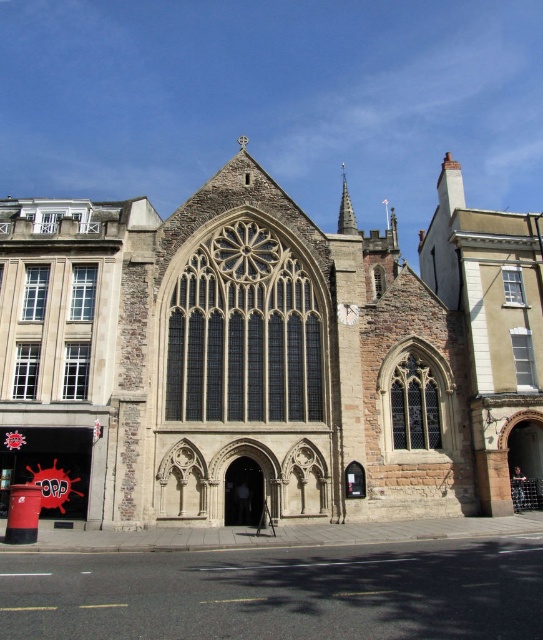
Consider the image. Can you confirm if smooth stone spire at upper center is thinner than white stone clock at center?

In fact, smooth stone spire at upper center might be wider than white stone clock at center.

Is smooth stone spire at upper center to the left of white stone clock at center from the viewer's perspective?

Incorrect, smooth stone spire at upper center is not on the left side of white stone clock at center.

Does point (343, 173) come behind point (345, 317)?

Yes, it is behind point (345, 317).

Identify the location of smooth stone spire at upper center. (345, 209).

Does beige stone church at center appear on the right side of smooth stone spire at upper center?

No, beige stone church at center is not to the right of smooth stone spire at upper center.

Does beige stone church at center lie in front of smooth stone spire at upper center?

Yes.

Describe the element at coordinates (266, 358) in the screenshot. I see `beige stone church at center` at that location.

What are the coordinates of `beige stone church at center` in the screenshot? It's located at (266, 358).

Does point (106, 289) come farther from viewer compared to point (356, 314)?

No, it is not.

Which is behind, point (150, 392) or point (345, 317)?

The point (345, 317) is behind.

At what (x,y) coordinates should I click in order to perform the action: click on beige stone church at center. Please return your answer as a coordinate pair (x, y). This screenshot has height=640, width=543. Looking at the image, I should click on click(x=266, y=358).